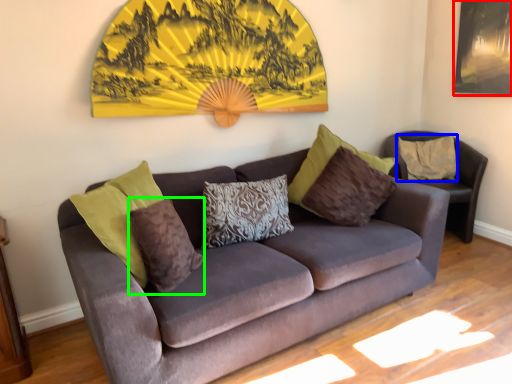
Question: Which is nearer to the picture frame (highlighted by a red box)? pillow (highlighted by a blue box) or pillow (highlighted by a green box).

Choices:
 (A) pillow
 (B) pillow

Answer: (A)